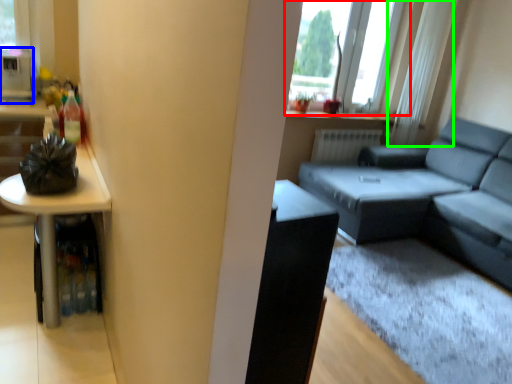
Question: Which object is the closest to the window (highlighted by a red box)? Choose among these: appliance (highlighted by a blue box) or curtain (highlighted by a green box).

Choices:
 (A) appliance
 (B) curtain

Answer: (B)